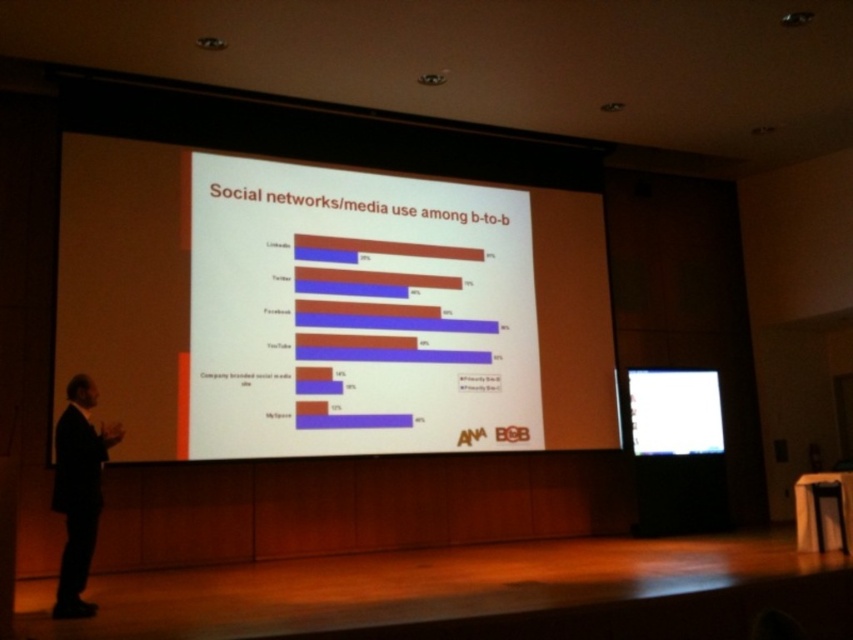
You are an attendee sitting at the back of the conference room and want to get a better view of the presenter in the black suit at left. Can you move to the right side of the white matte projection screen at center to see him better?

The black suit at left is behind the white matte projection screen at center, so moving to the right side of the white matte projection screen at center might block your view of the presenter.

You are an attendee sitting in the back row of the conference room. You want to see both the black suit at left and the white glossy projector screen at center clearly. Which one do you think will be easier to see from your current position?

The white glossy projector screen at center will be easier to see from the back row because it is larger than the black suit at left.

You are seated in the front row of the conference room and want to take a photo of the presenter in his black suit at left. Where should you aim your camera to capture him?

You should aim your camera at point [78,492] to capture the black suit at left.